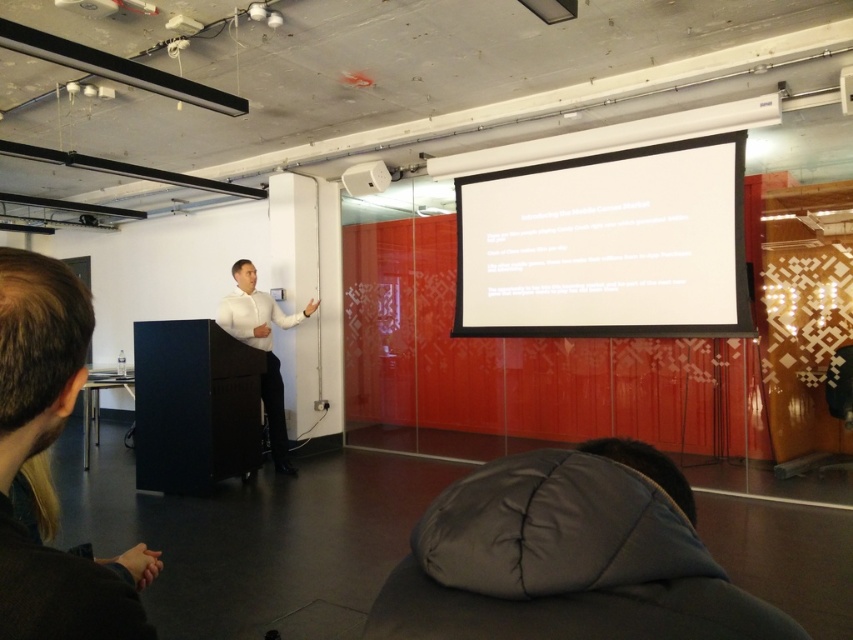
Looking at this image, can you confirm if dark brown leather jacket at lower left is wider than white glossy shirt at center?

No.

Is dark brown leather jacket at lower left behind white glossy shirt at center?

No, dark brown leather jacket at lower left is in front of white glossy shirt at center.

Which is behind, point (126, 614) or point (251, 317)?

Point (251, 317)

The height and width of the screenshot is (640, 853). What are the coordinates of `dark brown leather jacket at lower left` in the screenshot? It's located at [x=41, y=452].

Who is taller, white glossy shirt at center or white plastic speaker at upper center?

With more height is white glossy shirt at center.

Is white glossy shirt at center shorter than white plastic speaker at upper center?

No.

Measure the distance between white glossy shirt at center and camera.

white glossy shirt at center is 16.69 feet away from camera.

This screenshot has height=640, width=853. Find the location of `white glossy shirt at center`. white glossy shirt at center is located at coordinates (262, 348).

This screenshot has height=640, width=853. Describe the element at coordinates (41, 452) in the screenshot. I see `dark brown leather jacket at lower left` at that location.

Is dark brown leather jacket at lower left below white plastic speaker at upper center?

Correct, dark brown leather jacket at lower left is located below white plastic speaker at upper center.

Who is more forward, [64,289] or [351,182]?

Point [64,289] is more forward.

The width and height of the screenshot is (853, 640). I want to click on dark brown leather jacket at lower left, so click(x=41, y=452).